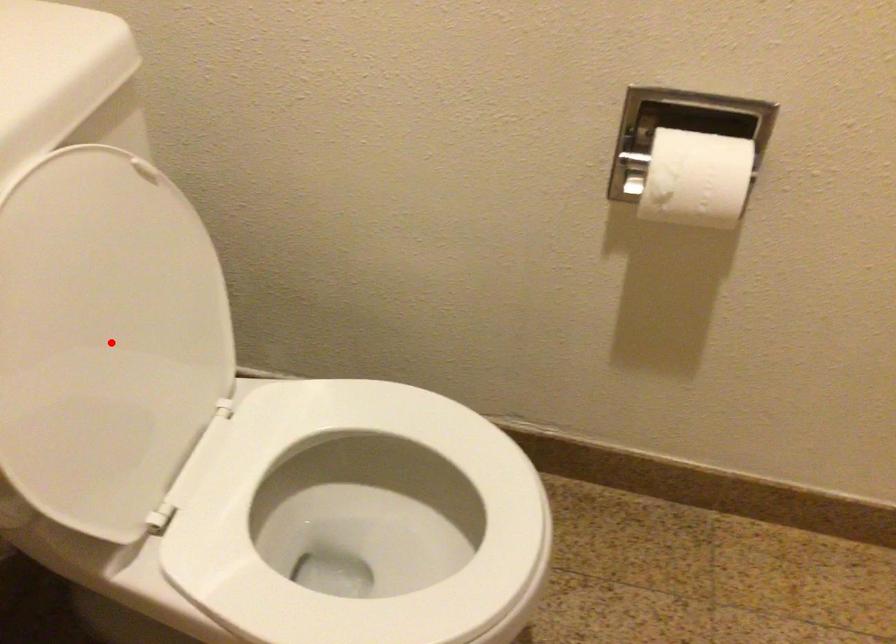
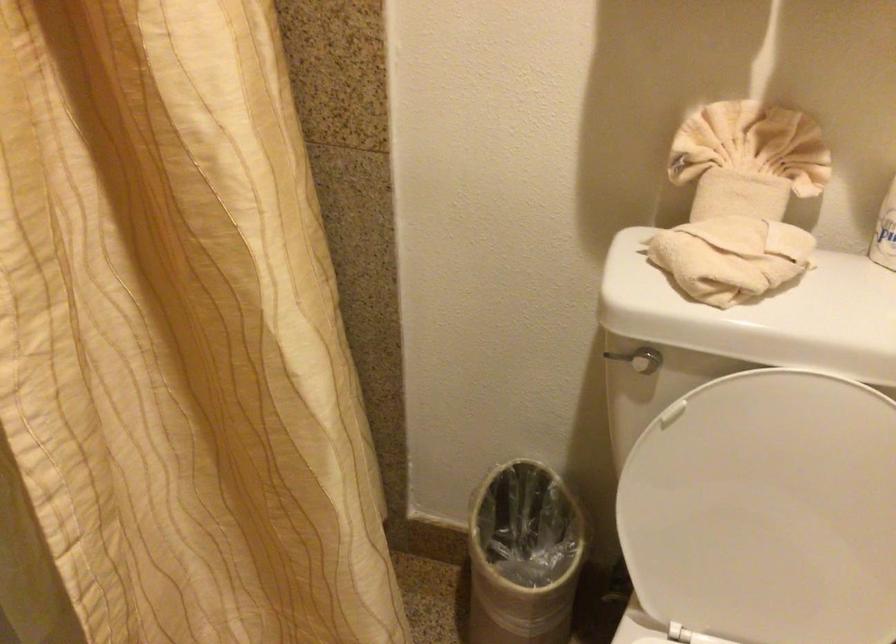
The point at the highlighted location is marked in the first image. Where is the corresponding point in the second image?

(767, 511)